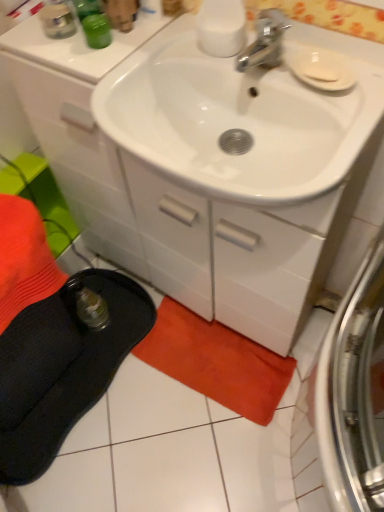
Locate an element on the screen. This screenshot has width=384, height=512. blank area to the left of white matte soap at upper right is located at coordinates (262, 68).